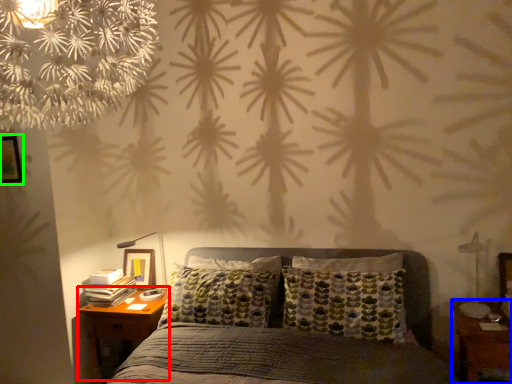
Question: Estimate the real-world distances between objects in this image. Which object is closer to nightstand (highlighted by a red box), nightstand (highlighted by a blue box) or picture frame (highlighted by a green box)?

Choices:
 (A) nightstand
 (B) picture frame

Answer: (B)